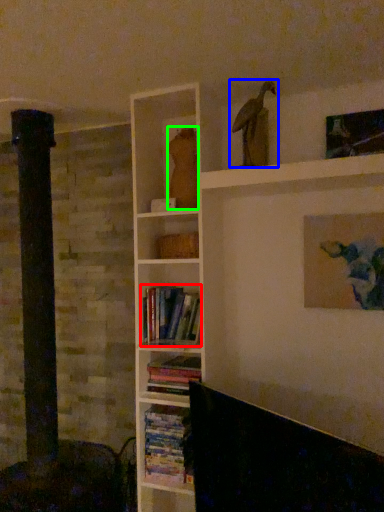
Question: Based on their relative distances, which object is nearer to book (highlighted by a red box)? Choose from bird (highlighted by a blue box) and animal (highlighted by a green box).

Choices:
 (A) bird
 (B) animal

Answer: (B)